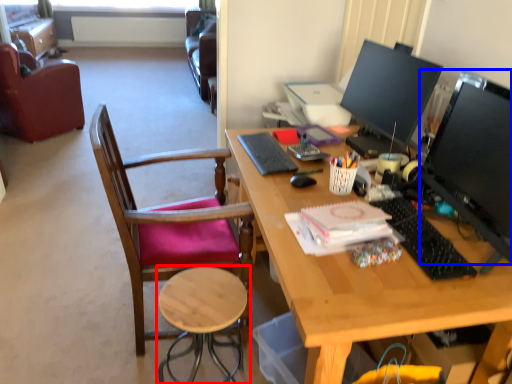
Question: Which object is further to the camera taking this photo, stool (highlighted by a red box) or television (highlighted by a blue box)?

Choices:
 (A) stool
 (B) television

Answer: (A)